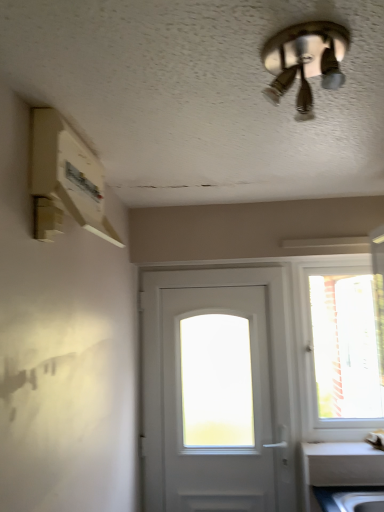
Question: Can you confirm if transparent glass window at right is shorter than metallic silver ceiling fan at upper center?

Choices:
 (A) yes
 (B) no

Answer: (B)

Question: Could you tell me if transparent glass window at right is facing metallic silver ceiling fan at upper center?

Choices:
 (A) yes
 (B) no

Answer: (A)

Question: Can you confirm if transparent glass window at right is wider than metallic silver ceiling fan at upper center?

Choices:
 (A) yes
 (B) no

Answer: (B)

Question: Can we say transparent glass window at right lies outside metallic silver ceiling fan at upper center?

Choices:
 (A) yes
 (B) no

Answer: (A)

Question: From a real-world perspective, is transparent glass window at right below metallic silver ceiling fan at upper center?

Choices:
 (A) yes
 (B) no

Answer: (A)

Question: From a real-world perspective, does transparent glass window at right stand above metallic silver ceiling fan at upper center?

Choices:
 (A) yes
 (B) no

Answer: (B)

Question: Is white matte door at center at the back of metallic silver ceiling fan at upper center?

Choices:
 (A) yes
 (B) no

Answer: (B)

Question: Is metallic silver ceiling fan at upper center further to the viewer compared to white matte door at center?

Choices:
 (A) no
 (B) yes

Answer: (A)

Question: Can you confirm if metallic silver ceiling fan at upper center is shorter than white matte door at center?

Choices:
 (A) no
 (B) yes

Answer: (B)

Question: Does metallic silver ceiling fan at upper center appear on the left side of white matte door at center?

Choices:
 (A) no
 (B) yes

Answer: (A)

Question: Is metallic silver ceiling fan at upper center completely or partially outside of white matte door at center?

Choices:
 (A) no
 (B) yes

Answer: (B)

Question: Does metallic silver ceiling fan at upper center have a larger size compared to white matte door at center?

Choices:
 (A) no
 (B) yes

Answer: (A)

Question: Can you confirm if metallic silver ceiling fan at upper center is wider than transparent glass window at right?

Choices:
 (A) yes
 (B) no

Answer: (A)